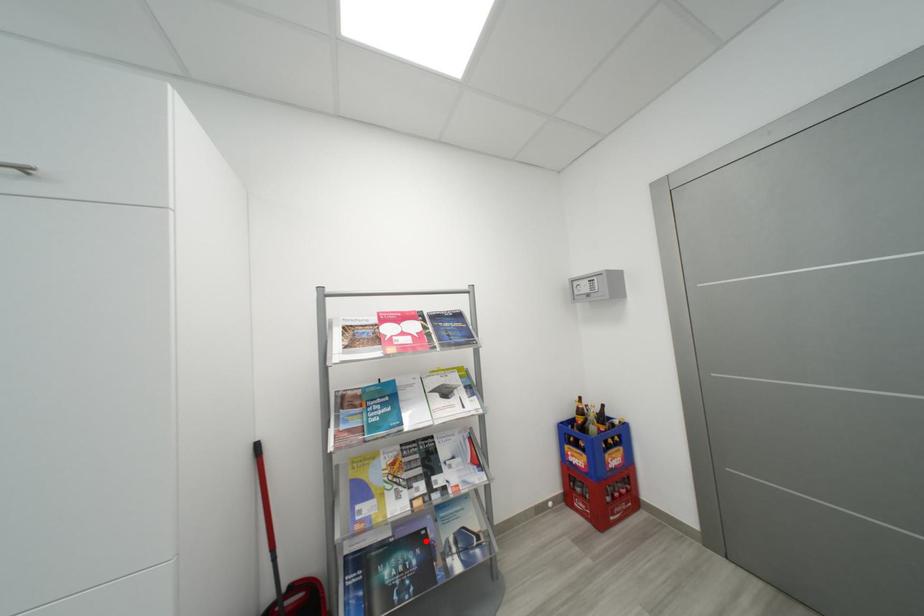
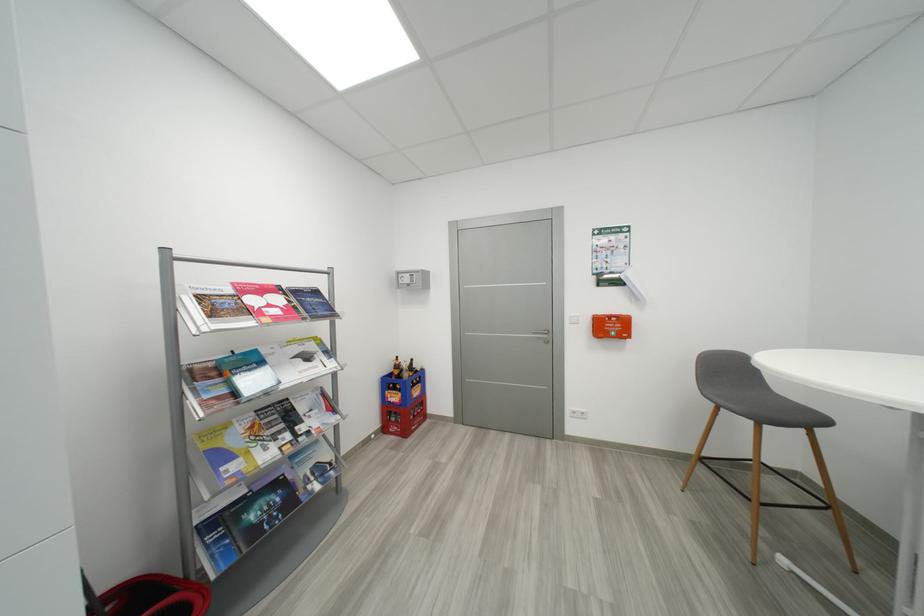
Find the pixel in the second image that matches the highlighted location in the first image.

(285, 485)